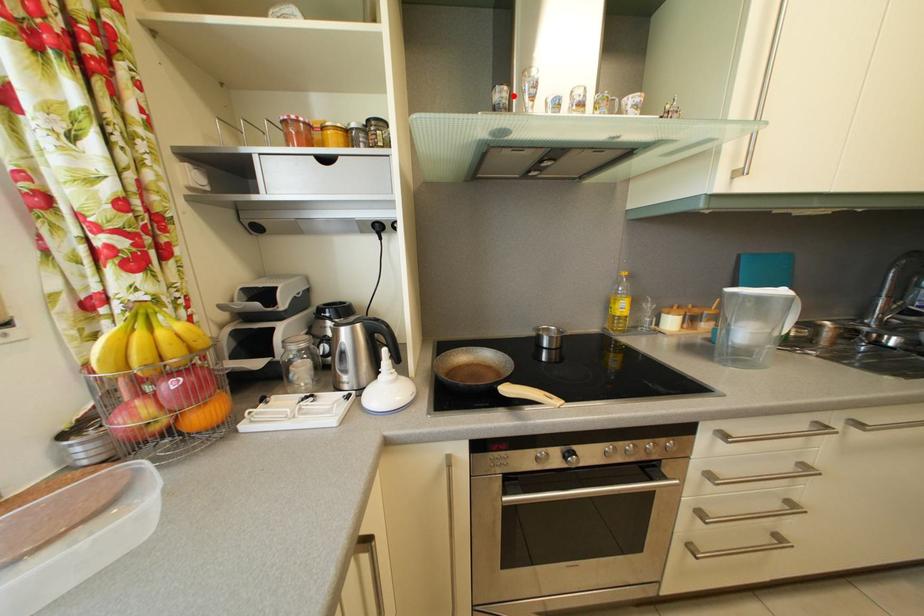
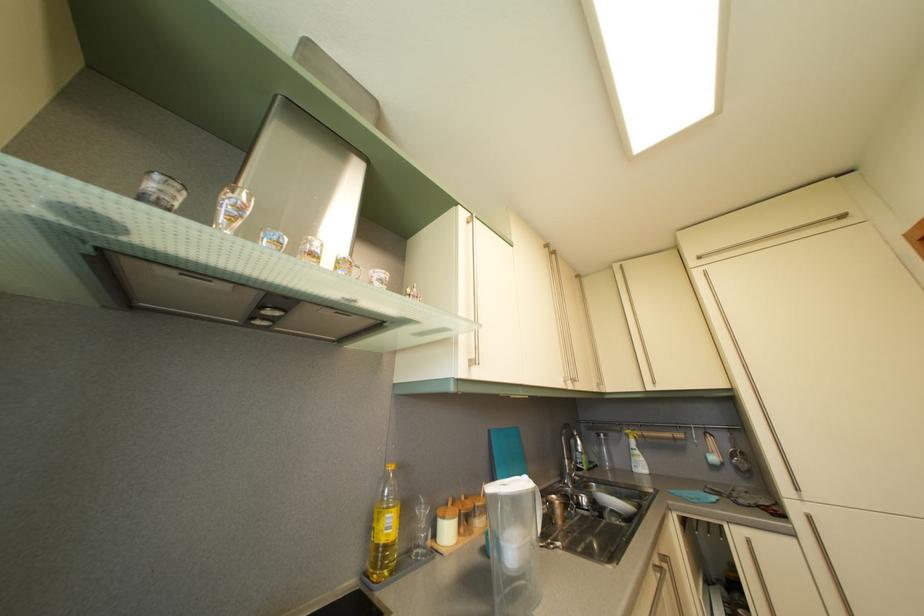
Question: I am providing you with two images of the same scene from different viewpoints. A red point is marked on the first image. At the location where the point appears in image 1, is it still visible in image 2?

Choices:
 (A) Yes
 (B) No

Answer: (A)